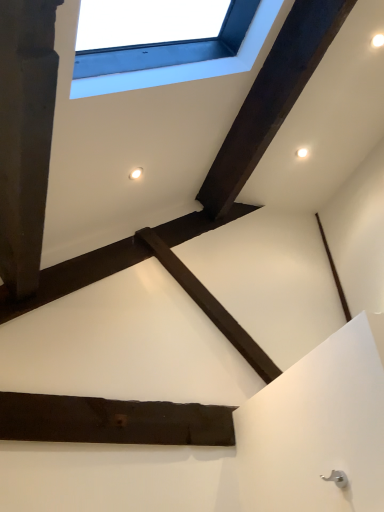
The image size is (384, 512). I want to click on dark wood plank at center, which is counted as the second plank, starting from the right, so click(x=113, y=421).

From the image's perspective, which is above, dark brown wood at upper center, acting as the 1th plank starting from the right, or dark wood plank at center, placed as the 2th plank when sorted from top to bottom?

From the image's view, dark brown wood at upper center, acting as the 1th plank starting from the right, is above.

Is dark brown wood at upper center, acting as the 1th plank starting from the right, spatially inside dark wood plank at center, placed as the 2th plank when sorted from top to bottom, or outside of it?

dark brown wood at upper center, acting as the 1th plank starting from the right, is spatially situated outside dark wood plank at center, placed as the 2th plank when sorted from top to bottom.

From a real-world perspective, between dark brown wood at upper center, the second plank ordered from the bottom, and dark wood plank at center, placed as the 2th plank when sorted from top to bottom, who is vertically higher?

From a 3D spatial view, dark brown wood at upper center, the second plank ordered from the bottom, is above.

Considering the points (350, 2) and (51, 428), which point is behind, point (350, 2) or point (51, 428)?

The point (350, 2) is farther.

From the image's perspective, is white plastic window at upper center beneath dark brown wood at upper center, acting as the 1th plank starting from the right?

Incorrect, from the image's perspective, white plastic window at upper center is higher than dark brown wood at upper center, acting as the 1th plank starting from the right.

Is white plastic window at upper center positioned with its back to dark brown wood at upper center, the second plank ordered from the bottom?

No, white plastic window at upper center is not facing the opposite direction of dark brown wood at upper center, the second plank ordered from the bottom.

Considering the relative sizes of white plastic window at upper center and dark brown wood at upper center, the second plank ordered from the bottom, in the image provided, is white plastic window at upper center bigger than dark brown wood at upper center, the second plank ordered from the bottom,?

Indeed, white plastic window at upper center has a larger size compared to dark brown wood at upper center, the second plank ordered from the bottom.

How distant is white plastic window at upper center from dark brown wood at upper center, acting as the 1th plank starting from the right?

white plastic window at upper center is 40.75 centimeters away from dark brown wood at upper center, acting as the 1th plank starting from the right.

Is white plastic window at upper center beside dark wood plank at center, the first plank from the bottom?

No, white plastic window at upper center is not next to dark wood plank at center, the first plank from the bottom.

From the image's perspective, would you say white plastic window at upper center is shown under dark wood plank at center, which is counted as the second plank, starting from the right?

No.

Can we say white plastic window at upper center lies outside dark wood plank at center, which is counted as the second plank, starting from the right?

Absolutely, white plastic window at upper center is external to dark wood plank at center, which is counted as the second plank, starting from the right.

Looking at their sizes, would you say white plastic window at upper center is wider or thinner than dark wood plank at center, which is the 1th plank from left to right?

white plastic window at upper center is wider than dark wood plank at center, which is the 1th plank from left to right.

Between dark brown wood at upper center, the 1th plank in the top-to-bottom sequence, and white plastic window at upper center, which one has smaller size?

dark brown wood at upper center, the 1th plank in the top-to-bottom sequence.

Is there a large distance between dark brown wood at upper center, acting as the 1th plank starting from the right, and white plastic window at upper center?

No, dark brown wood at upper center, acting as the 1th plank starting from the right, is not far away from white plastic window at upper center.

Does dark brown wood at upper center, the 1th plank in the top-to-bottom sequence, have a lesser width compared to white plastic window at upper center?

Yes, dark brown wood at upper center, the 1th plank in the top-to-bottom sequence, is thinner than white plastic window at upper center.

Visually, is dark brown wood at upper center, acting as the 1th plank starting from the right, positioned to the left or to the right of white plastic window at upper center?

dark brown wood at upper center, acting as the 1th plank starting from the right, is to the right of white plastic window at upper center.

Can you confirm if dark wood plank at center, the first plank from the bottom, is shorter than dark brown wood at upper center, the second plank ordered from the bottom?

Incorrect, the height of dark wood plank at center, the first plank from the bottom, does not fall short of that of dark brown wood at upper center, the second plank ordered from the bottom.

From a real-world perspective, who is located lower, dark wood plank at center, which is the 1th plank from left to right, or dark brown wood at upper center, the second plank ordered from the bottom?

In real-world perspective, dark wood plank at center, which is the 1th plank from left to right, is lower.

Consider the image. Does dark wood plank at center, placed as the 2th plank when sorted from top to bottom, appear on the left side of dark brown wood at upper center, the second plank from the left?

Yes, dark wood plank at center, placed as the 2th plank when sorted from top to bottom, is to the left of dark brown wood at upper center, the second plank from the left.

Does dark wood plank at center, which is the 1th plank from left to right, have a greater width compared to dark brown wood at upper center, acting as the 1th plank starting from the right?

No, dark wood plank at center, which is the 1th plank from left to right, is not wider than dark brown wood at upper center, acting as the 1th plank starting from the right.

Considering the sizes of objects dark wood plank at center, which is the 1th plank from left to right, and white plastic window at upper center in the image provided, who is wider, dark wood plank at center, which is the 1th plank from left to right, or white plastic window at upper center?

white plastic window at upper center.

Can you confirm if dark wood plank at center, placed as the 2th plank when sorted from top to bottom, is positioned to the left of white plastic window at upper center?

Yes, dark wood plank at center, placed as the 2th plank when sorted from top to bottom, is to the left of white plastic window at upper center.

From a real-world perspective, is dark wood plank at center, which is counted as the second plank, starting from the right, on white plastic window at upper center?

No.

Is point (39, 422) closer to viewer compared to point (256, 31)?

Yes, point (39, 422) is closer to viewer.

Identify the location of plank in front of the dark brown wood at upper center, the second plank from the left. The image size is (384, 512). (113, 421).

Locate an element on the screen. window above the dark brown wood at upper center, the second plank from the left (from the image's perspective) is located at coordinates (187, 64).

When comparing their distances from white plastic window at upper center, does dark brown wood at upper center, the second plank ordered from the bottom, or dark wood plank at center, which is counted as the second plank, starting from the right, seem closer?

dark brown wood at upper center, the second plank ordered from the bottom, is closer to white plastic window at upper center.

Which object lies nearer to the anchor point dark brown wood at upper center, the 1th plank in the top-to-bottom sequence, dark wood plank at center, which is counted as the second plank, starting from the right, or white plastic window at upper center?

white plastic window at upper center lies closer to dark brown wood at upper center, the 1th plank in the top-to-bottom sequence, than the other object.

Which object lies nearer to the anchor point dark wood plank at center, which is counted as the second plank, starting from the right, dark brown wood at upper center, the 1th plank in the top-to-bottom sequence, or white plastic window at upper center?

The object closer to dark wood plank at center, which is counted as the second plank, starting from the right, is white plastic window at upper center.

Based on their spatial positions, is white plastic window at upper center or dark brown wood at upper center, acting as the 1th plank starting from the right, closer to dark wood plank at center, the first plank from the bottom?

Based on the image, white plastic window at upper center appears to be nearer to dark wood plank at center, the first plank from the bottom.

Estimate the real-world distances between objects in this image. Which object is further from white plastic window at upper center, dark wood plank at center, which is counted as the second plank, starting from the right, or dark brown wood at upper center, acting as the 1th plank starting from the right?

Among the two, dark wood plank at center, which is counted as the second plank, starting from the right, is located further to white plastic window at upper center.

Based on their spatial positions, is white plastic window at upper center or dark wood plank at center, which is counted as the second plank, starting from the right, further from dark brown wood at upper center, acting as the 1th plank starting from the right?

The object further to dark brown wood at upper center, acting as the 1th plank starting from the right, is dark wood plank at center, which is counted as the second plank, starting from the right.

Find the location of `plank between white plastic window at upper center and dark wood plank at center, which is counted as the second plank, starting from the right, in the vertical direction`. plank between white plastic window at upper center and dark wood plank at center, which is counted as the second plank, starting from the right, in the vertical direction is located at coordinates (271, 98).